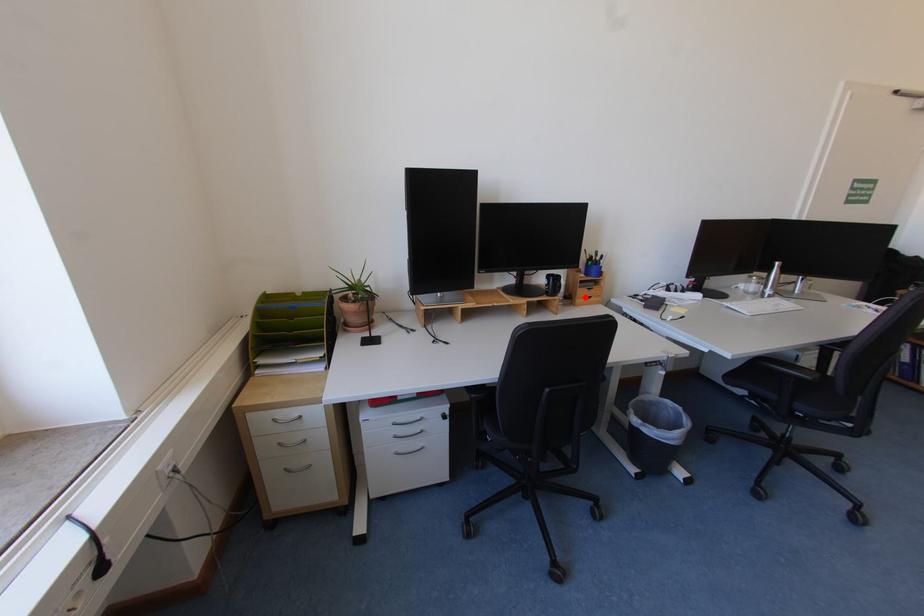
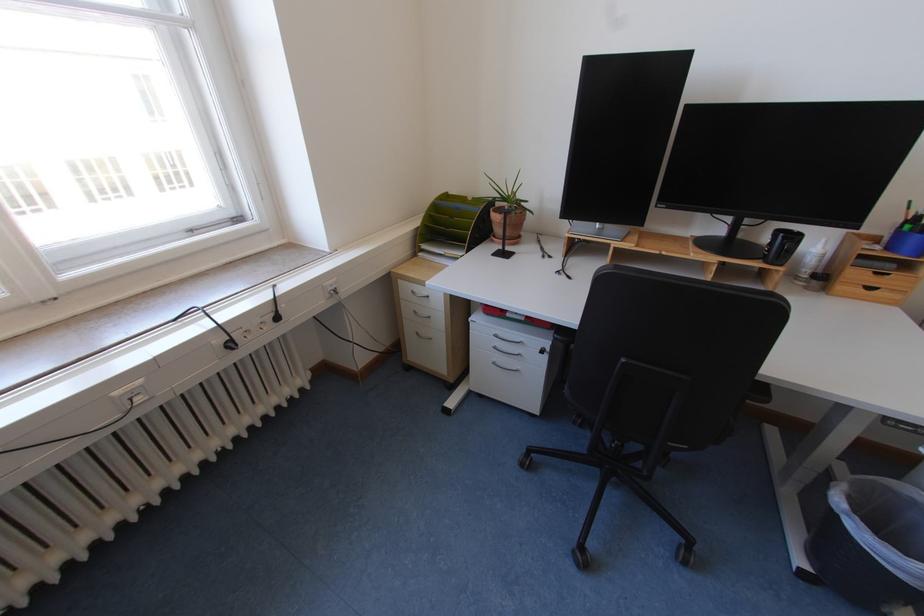
In the second image, find the point that corresponds to the highlighted location in the first image.

(848, 281)